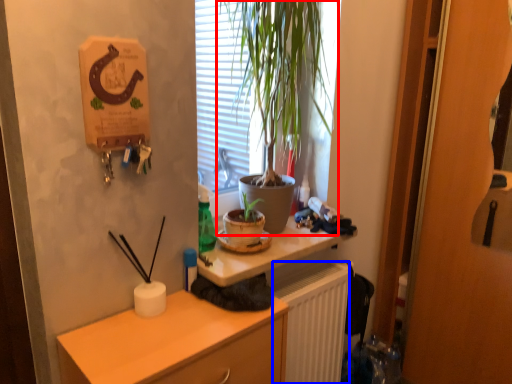
Question: Which point is further to the camera, houseplant (highlighted by a red box) or radiator (highlighted by a blue box)?

Choices:
 (A) houseplant
 (B) radiator

Answer: (B)